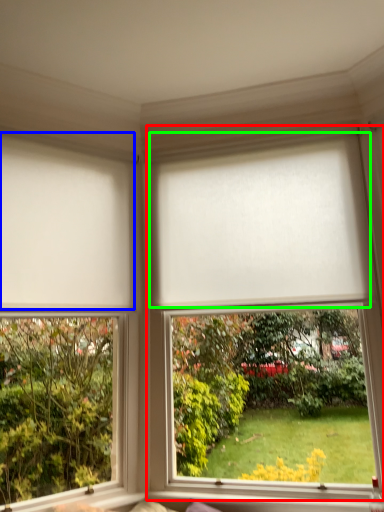
Question: Estimate the real-world distances between objects in this image. Which object is farther from window (highlighted by a red box), blind (highlighted by a blue box) or blind (highlighted by a green box)?

Choices:
 (A) blind
 (B) blind

Answer: (A)